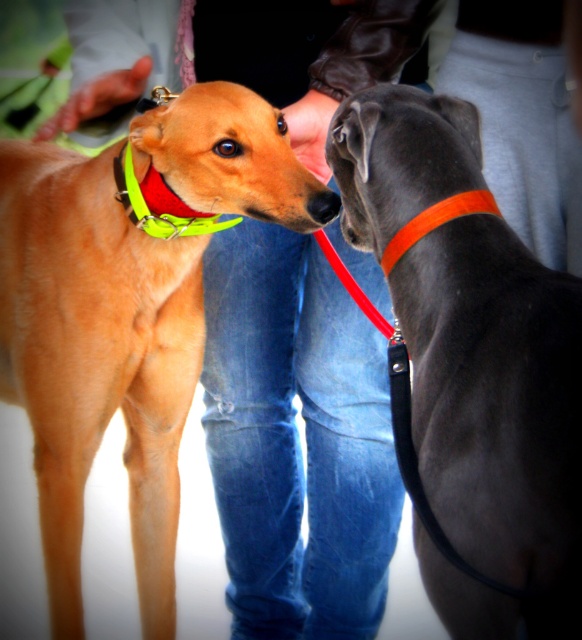
Is matte yellow collar at left bigger than green fabric neckband at left?

Yes.

Is matte yellow collar at left positioned in front of green fabric neckband at left?

That is True.

Between point (33, 365) and point (129, 148), which one is positioned behind?

The point (33, 365) is more distant.

Locate an element on the screen. The image size is (582, 640). matte yellow collar at left is located at coordinates (125, 310).

Is green fabric neckband at left closer to camera compared to neon yellow fabric neckband at left?

Yes, it is in front of neon yellow fabric neckband at left.

Image resolution: width=582 pixels, height=640 pixels. What are the coordinates of `green fabric neckband at left` in the screenshot? It's located at (159, 204).

Who is shorter, matte yellow collar at left or black rubber nose at center?

With less height is black rubber nose at center.

Does point (69, 401) come in front of point (328, 209)?

No, (69, 401) is further to viewer.

The height and width of the screenshot is (640, 582). I want to click on matte yellow collar at left, so click(x=125, y=310).